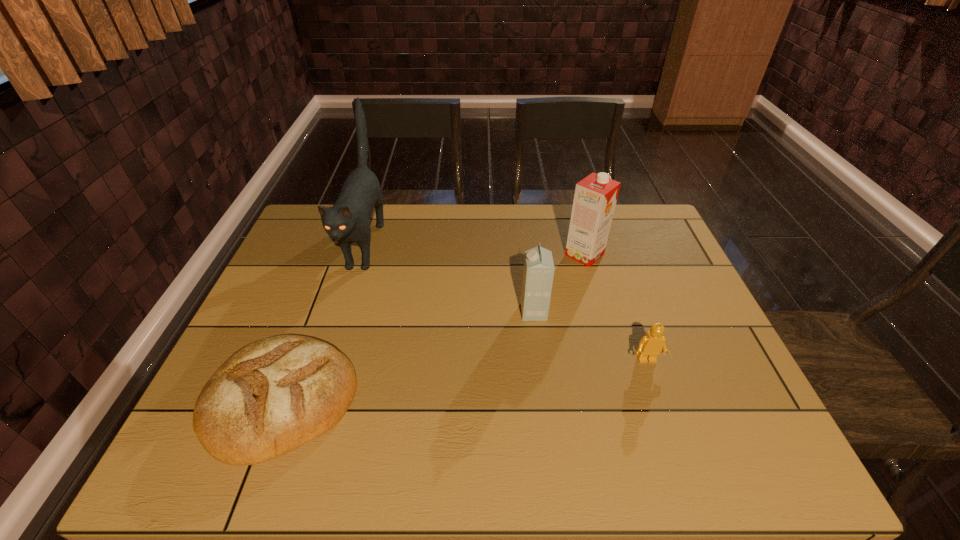
The width and height of the screenshot is (960, 540). In order to click on the tallest object in this screenshot , I will do `click(348, 220)`.

Find the location of `the farther carton`. the farther carton is located at coordinates (595, 197).

Identify the location of the right carton. (595, 197).

Locate an element on the screen. Image resolution: width=960 pixels, height=540 pixels. the shorter carton is located at coordinates click(538, 272).

The image size is (960, 540). I want to click on the third nearest object, so 538,272.

Locate an element on the screen. The width and height of the screenshot is (960, 540). the fourth tallest object is located at coordinates (650, 346).

This screenshot has height=540, width=960. Identify the location of bread. pos(273,395).

Image resolution: width=960 pixels, height=540 pixels. What are the coordinates of `vacant point located 0.200m at the face of the tallest object` in the screenshot? It's located at (331, 350).

Where is `vacant space located 0.090m on the front of the taller carton`? The width and height of the screenshot is (960, 540). vacant space located 0.090m on the front of the taller carton is located at coordinates (594, 288).

You are a GUI agent. You are given a task and a screenshot of the screen. Output one action in this format:
    pyautogui.click(x=<x>, y=<y>)
    Task: Click on the vacant space positioned 0.230m on the front label of the third nearest object
    
    Given the screenshot: What is the action you would take?
    pyautogui.click(x=435, y=312)